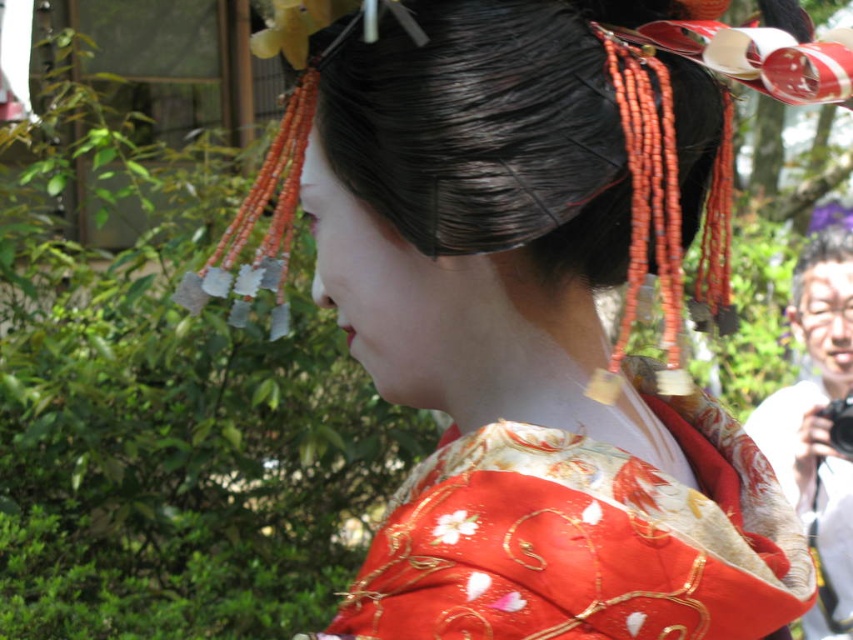
Image resolution: width=853 pixels, height=640 pixels. Describe the element at coordinates (523, 346) in the screenshot. I see `silky kimono at center` at that location.

Who is more forward, (434, 266) or (677, 563)?

Point (677, 563)

Does point (402, 513) lie in front of point (489, 570)?

No.

Identify the location of silky kimono at center. This screenshot has height=640, width=853. (523, 346).

This screenshot has width=853, height=640. Describe the element at coordinates (523, 346) in the screenshot. I see `silky kimono at center` at that location.

Who is more distant from viewer, (570, 108) or (849, 257)?

Point (849, 257)

Does point (578, 195) lie in front of point (820, 230)?

Yes, it is in front of point (820, 230).

What are the coordinates of `silky kimono at center` in the screenshot? It's located at [x=523, y=346].

Can you confirm if silky red kimono at center is smaller than black glossy hair at upper right?

Incorrect, silky red kimono at center is not smaller in size than black glossy hair at upper right.

The height and width of the screenshot is (640, 853). Identify the location of silky red kimono at center. (584, 538).